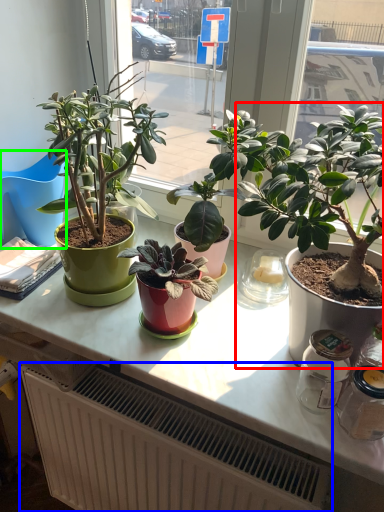
Question: Which object is the farthest from houseplant (highlighted by a red box)? Choose among these: radiator (highlighted by a blue box) or chair (highlighted by a green box).

Choices:
 (A) radiator
 (B) chair

Answer: (B)